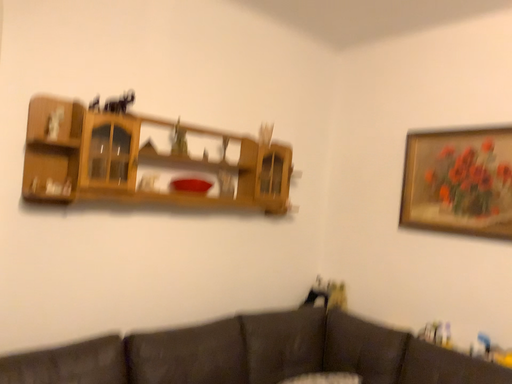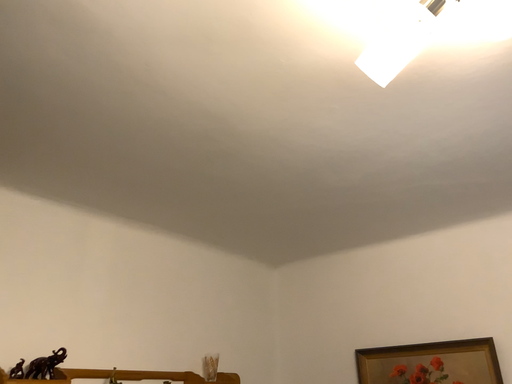
Question: How did the camera likely rotate when shooting the video?

Choices:
 (A) rotated left
 (B) rotated right

Answer: (B)